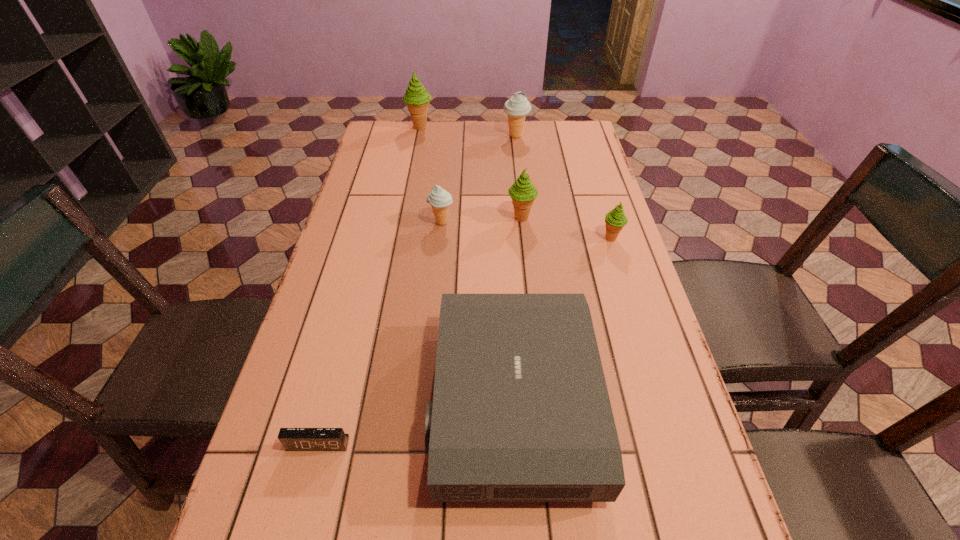
Locate an element on the screen. This screenshot has height=540, width=960. projector is located at coordinates (521, 412).

At what (x,y) coordinates should I click in order to perform the action: click on alarm clock. Please return your answer as a coordinate pair (x, y). This screenshot has width=960, height=540. Looking at the image, I should click on (293, 439).

Locate an element on the screen. Image resolution: width=960 pixels, height=540 pixels. vacant space situated on the front of the tallest icecream is located at coordinates (413, 163).

Identify the location of vacant region located 0.090m on the left of the bigger beige icecream. (478, 136).

Where is `vacant space located 0.200m on the right of the second green icecream from right to left`? Image resolution: width=960 pixels, height=540 pixels. vacant space located 0.200m on the right of the second green icecream from right to left is located at coordinates (604, 218).

Find the location of a particular element. The width and height of the screenshot is (960, 540). free spot located on the back of the fourth icecream from right to left is located at coordinates (448, 154).

At what (x,y) coordinates should I click in order to perform the action: click on free space located 0.180m on the left of the rightmost object. Please return your answer as a coordinate pair (x, y). The image size is (960, 540). Looking at the image, I should click on (536, 239).

Find the location of `free space located on the front-facing side of the projector`. free space located on the front-facing side of the projector is located at coordinates (358, 403).

The width and height of the screenshot is (960, 540). I want to click on vacant space located 0.100m on the front-facing side of the projector, so click(384, 403).

The height and width of the screenshot is (540, 960). I want to click on free space located 0.260m on the front-facing side of the projector, so click(x=303, y=403).